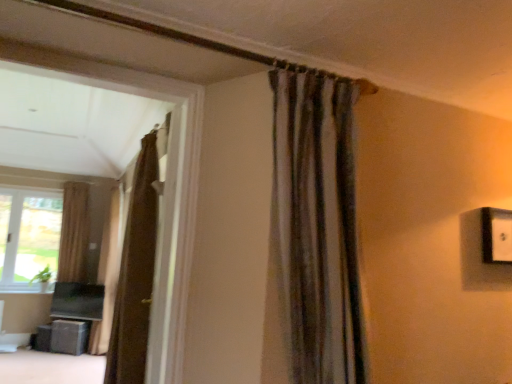
Question: In which direction should I rotate to look at brown textured curtain at center, the third curtain viewed from the front?

Choices:
 (A) right
 (B) left

Answer: (B)

Question: Does textured gray curtain at upper center, placed as the 1th curtain when sorted from front to back, have a lesser width compared to matte black speaker at lower left?

Choices:
 (A) no
 (B) yes

Answer: (A)

Question: Considering the relative sizes of textured gray curtain at upper center, which is counted as the 1th curtain, starting from the right, and matte black speaker at lower left in the image provided, is textured gray curtain at upper center, which is counted as the 1th curtain, starting from the right, bigger than matte black speaker at lower left?

Choices:
 (A) yes
 (B) no

Answer: (A)

Question: Is textured gray curtain at upper center, positioned as the 4th curtain in back-to-front order, wider than matte black speaker at lower left?

Choices:
 (A) no
 (B) yes

Answer: (B)

Question: Is textured gray curtain at upper center, which is counted as the 1th curtain, starting from the right, oriented away from matte black speaker at lower left?

Choices:
 (A) no
 (B) yes

Answer: (B)

Question: From a real-world perspective, is textured gray curtain at upper center, placed as the 1th curtain when sorted from front to back, positioned under matte black speaker at lower left based on gravity?

Choices:
 (A) no
 (B) yes

Answer: (A)

Question: Can you see textured gray curtain at upper center, which is counted as the 1th curtain, starting from the right, touching matte black speaker at lower left?

Choices:
 (A) no
 (B) yes

Answer: (A)

Question: Is matte black speaker at lower left turned away from beige fabric curtain at left, which ranks as the fourth curtain in front-to-back order?

Choices:
 (A) no
 (B) yes

Answer: (A)

Question: Does matte black speaker at lower left have a lesser width compared to beige fabric curtain at left, which is counted as the first curtain, starting from the left?

Choices:
 (A) no
 (B) yes

Answer: (A)

Question: From a real-world perspective, is matte black speaker at lower left on beige fabric curtain at left, which is counted as the first curtain, starting from the left?

Choices:
 (A) yes
 (B) no

Answer: (B)

Question: Are matte black speaker at lower left and beige fabric curtain at left, the 4th curtain in the right-to-left sequence, making contact?

Choices:
 (A) yes
 (B) no

Answer: (B)

Question: Are matte black speaker at lower left and beige fabric curtain at left, which is counted as the first curtain, starting from the left, located far from each other?

Choices:
 (A) no
 (B) yes

Answer: (B)

Question: Can you confirm if matte black speaker at lower left is smaller than beige fabric curtain at left, which is counted as the first curtain, starting from the left?

Choices:
 (A) no
 (B) yes

Answer: (B)

Question: Can you confirm if beige fabric curtain at left, which is counted as the first curtain, starting from the left, is wider than brown textured curtain at center, placed as the second curtain when sorted from back to front?

Choices:
 (A) no
 (B) yes

Answer: (A)